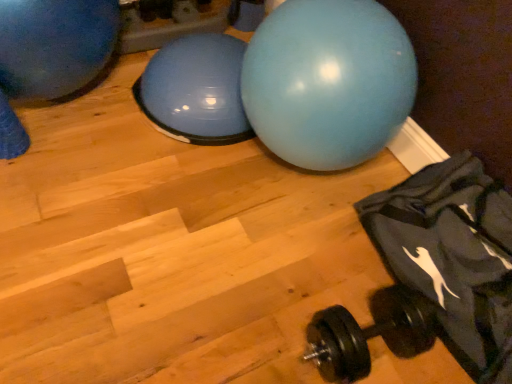
Question: Does point (436, 180) appear closer or farther from the camera than point (44, 69)?

Choices:
 (A) closer
 (B) farther

Answer: (A)

Question: From the image's perspective, is dark gray fabric bean bag chair at lower right located above or below blue rubber ball at upper left, placed as the first ball when sorted from left to right?

Choices:
 (A) below
 (B) above

Answer: (A)

Question: Considering the real-world distances, which object is closest to the black rubber dumbbell at lower right?

Choices:
 (A) matte blue ball at center, which is counted as the 1th ball, starting from the right
 (B) dark gray fabric bean bag chair at lower right
 (C) blue rubber ball at upper left, placed as the first ball when sorted from left to right

Answer: (B)

Question: Estimate the real-world distances between objects in this image. Which object is farther from the blue rubber ball at upper left, the 2th ball from the right?

Choices:
 (A) black rubber dumbbell at lower right
 (B) matte blue ball at center, the 2th ball from the left
 (C) dark gray fabric bean bag chair at lower right

Answer: (C)